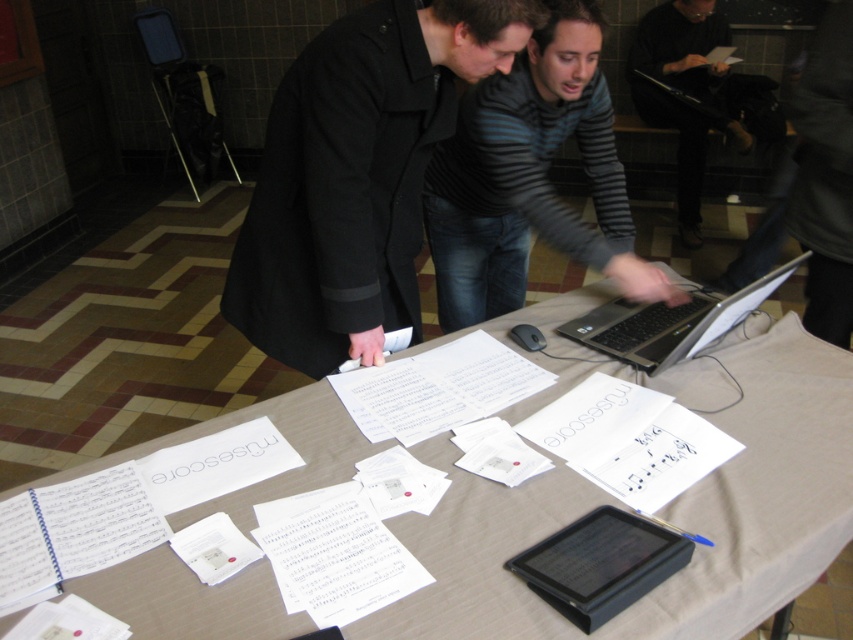
Question: Which point is closer to the camera taking this photo?

Choices:
 (A) (737, 116)
 (B) (596, 324)

Answer: (B)

Question: Does white paper at center appear on the right side of silver/black plastic laptop at center?

Choices:
 (A) no
 (B) yes

Answer: (A)

Question: Which object is positioned closest to the striped cotton shirt at center?

Choices:
 (A) black matte coat at center
 (B) silver/black plastic laptop at center
 (C) white paper at center

Answer: (B)

Question: Can you confirm if white paper at center is thinner than striped cotton shirt at center?

Choices:
 (A) yes
 (B) no

Answer: (B)

Question: From the image, what is the correct spatial relationship of striped cotton shirt at center in relation to dark gray sweater at upper right?

Choices:
 (A) right
 (B) left

Answer: (B)

Question: Which of the following is the farthest from the observer?

Choices:
 (A) (729, 538)
 (B) (683, 140)
 (C) (490, 186)
 (D) (459, 61)

Answer: (B)